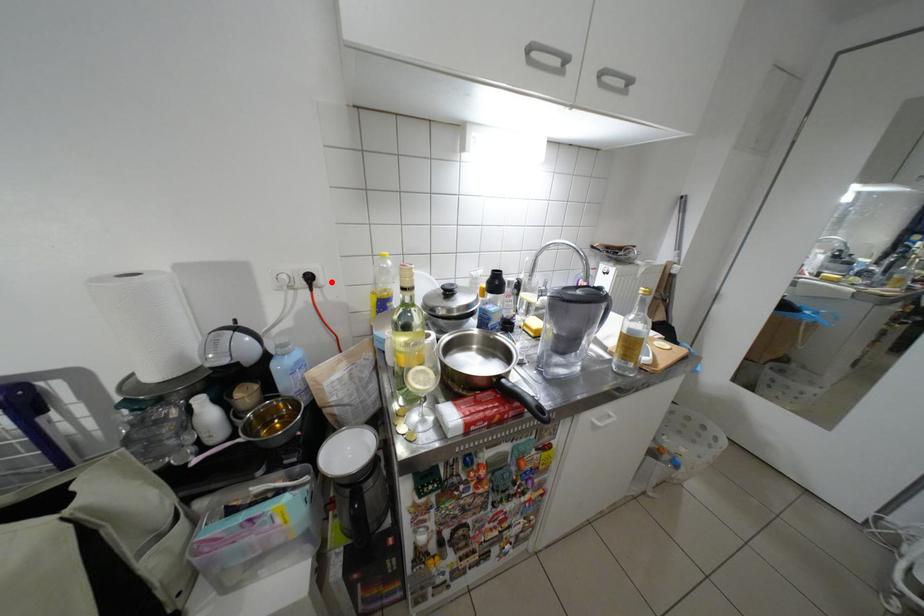
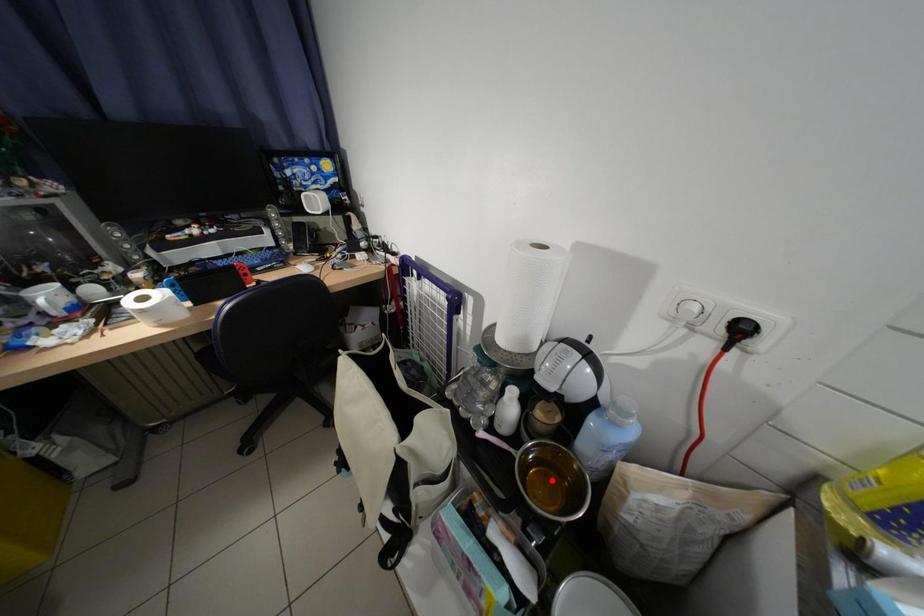
I am providing you with two images of the same scene from different viewpoints. A red point is marked on the first image and another point is marked on the second image. Do the highlighted points in image1 and image2 indicate the same real-world spot?

No